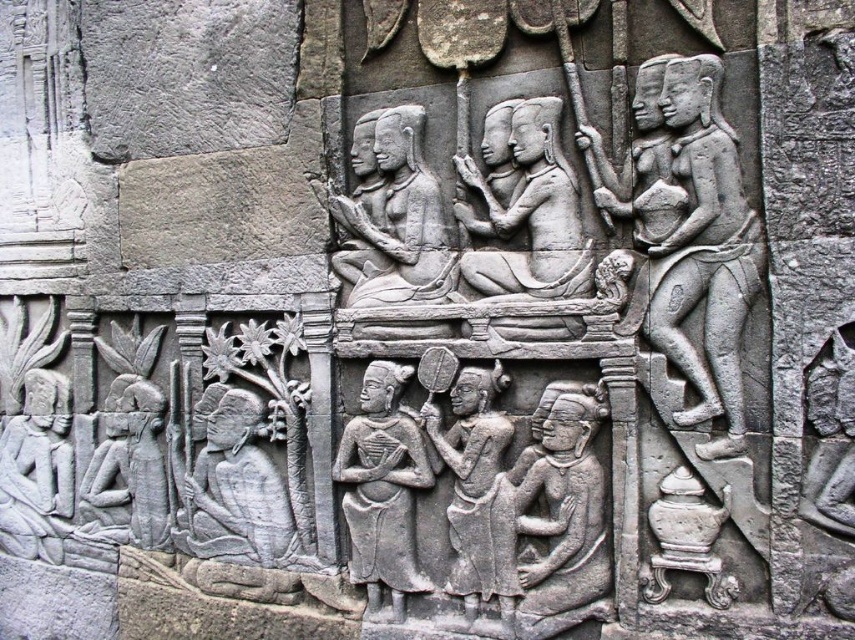
Which is more to the right, gray stone figures at center or gray stone carving of figures at center?

gray stone figures at center is more to the right.

Which of these two, gray stone figures at center or gray stone carving of figures at center, stands shorter?

gray stone figures at center

Is point (553, 180) positioned after point (417, 177)?

No, it is in front of (417, 177).

Locate an element on the screen. gray stone figures at center is located at coordinates (529, 212).

Is gray stone musician at lower left to the right of gray stone figure at lower left from the viewer's perspective?

Correct, you'll find gray stone musician at lower left to the right of gray stone figure at lower left.

Who is taller, gray stone musician at lower left or gray stone figure at lower left?

gray stone figure at lower left is taller.

The height and width of the screenshot is (640, 855). What are the coordinates of `gray stone musician at lower left` in the screenshot? It's located at (239, 484).

Between gray stone carving of figures at center and gray stone figure at center, which one appears on the left side from the viewer's perspective?

gray stone carving of figures at center is more to the left.

Does gray stone carving of figures at center appear over gray stone figure at center?

Correct, gray stone carving of figures at center is located above gray stone figure at center.

You are a GUI agent. You are given a task and a screenshot of the screen. Output one action in this format:
    pyautogui.click(x=<x>, y=<y>)
    Task: Click on the gray stone carving of figures at center
    This screenshot has width=855, height=640.
    Given the screenshot: What is the action you would take?
    pyautogui.click(x=399, y=221)

The width and height of the screenshot is (855, 640). In order to click on gray stone carving of figures at center in this screenshot , I will do `click(399, 221)`.